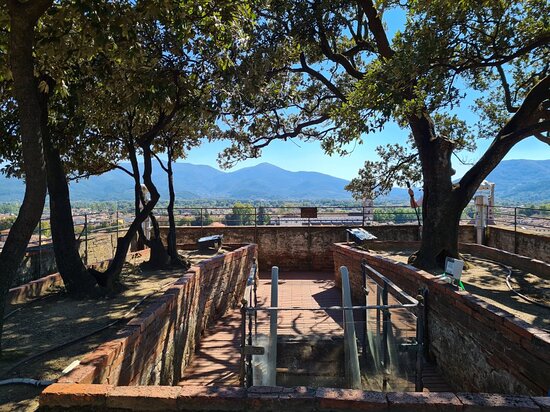
Where is `white box on wall`? white box on wall is located at coordinates (453, 267).